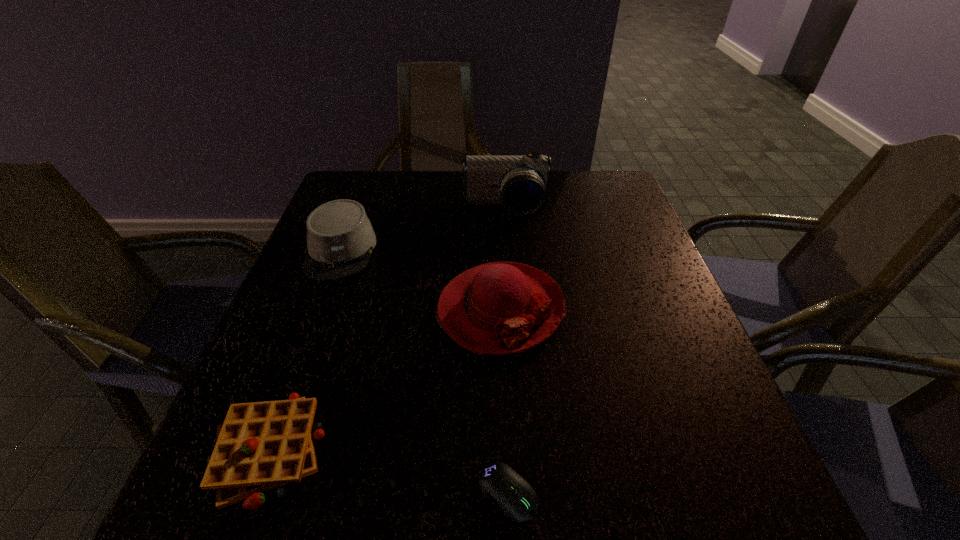
Locate an element on the screen. The image size is (960, 540). vacant space at the left edge of the desktop is located at coordinates (330, 355).

This screenshot has width=960, height=540. In the image, there is a desktop. What are the coordinates of `vacant space at the right edge` in the screenshot? It's located at (637, 257).

Locate an element on the screen. This screenshot has height=540, width=960. free space at the far left corner of the desktop is located at coordinates (363, 199).

Locate an element on the screen. The height and width of the screenshot is (540, 960). vacant region at the near left corner is located at coordinates (186, 501).

Where is `free space at the far right corner of the desktop`? This screenshot has width=960, height=540. free space at the far right corner of the desktop is located at coordinates (603, 172).

This screenshot has width=960, height=540. In order to click on vacant region at the near right corner in this screenshot , I will do (x=742, y=489).

Locate an element on the screen. This screenshot has width=960, height=540. vacant point located between the right hat and the farthest object is located at coordinates (503, 259).

At what (x,y) coordinates should I click in order to perform the action: click on empty space between the farthest object and the right hat. Please return your answer as a coordinate pair (x, y). The image size is (960, 540). Looking at the image, I should click on (503, 259).

Where is `vacant point located between the right hat and the camcorder`? vacant point located between the right hat and the camcorder is located at coordinates (503, 259).

The width and height of the screenshot is (960, 540). I want to click on free spot between the left hat and the shortest object, so click(424, 372).